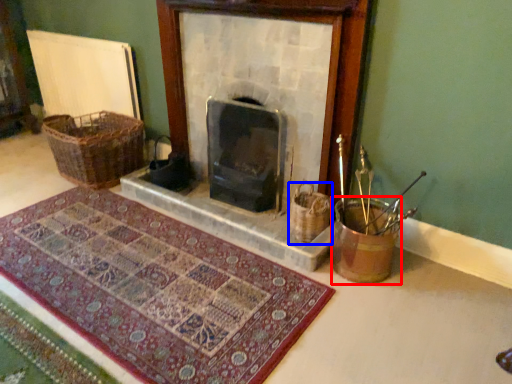
Question: Among these objects, which one is farthest to the camera, basket container (highlighted by a red box) or basket (highlighted by a blue box)?

Choices:
 (A) basket container
 (B) basket

Answer: (B)